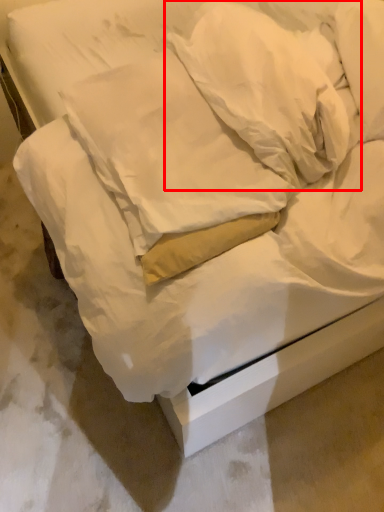
Question: From the image, what is the correct spatial relationship of pillow (annotated by the red box) in relation to pillow?

Choices:
 (A) left
 (B) right

Answer: (B)